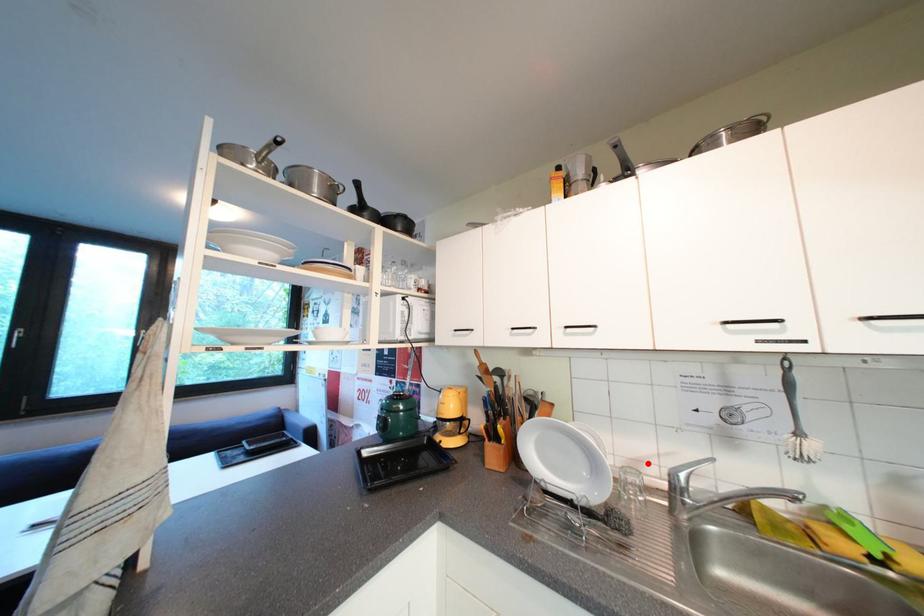
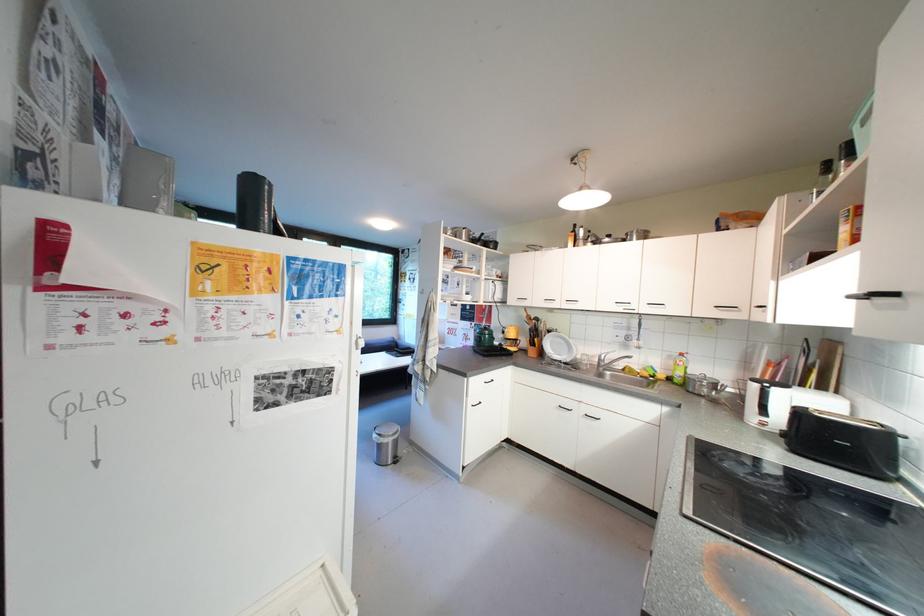
Locate, in the second image, the point that corresponds to the highlighted location in the first image.

(602, 359)